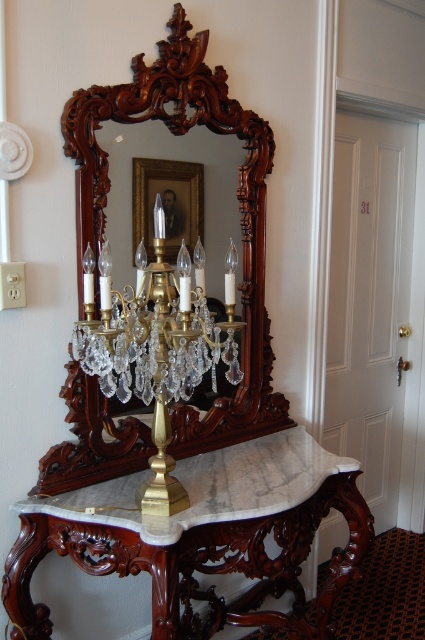
Question: Which of the following is the closest to the observer?

Choices:
 (A) brass/crystal chandelier at center
 (B) marble/carved wood table at center
 (C) mahogany wood mirror at upper center

Answer: (A)

Question: Is mahogany wood mirror at upper center wider than brass/crystal chandelier at center?

Choices:
 (A) no
 (B) yes

Answer: (B)

Question: In this image, where is marble/carved wood table at center located relative to mahogany wood mirror at upper center?

Choices:
 (A) above
 (B) below

Answer: (B)

Question: Based on their relative distances, which object is farther from the marble/carved wood table at center?

Choices:
 (A) mahogany wood mirror at upper center
 (B) brass/crystal chandelier at center

Answer: (B)

Question: Can you confirm if marble/carved wood table at center is bigger than mahogany wood mirror at upper center?

Choices:
 (A) no
 (B) yes

Answer: (B)

Question: Which of these objects is positioned farthest from the marble/carved wood table at center?

Choices:
 (A) mahogany wood mirror at upper center
 (B) brass/crystal chandelier at center

Answer: (B)